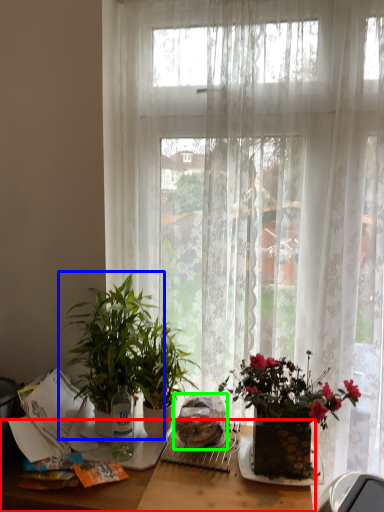
Question: Considering the real-world distances, which object is farthest from table (highlighted by a red box)? houseplant (highlighted by a blue box) or food (highlighted by a green box)?

Choices:
 (A) houseplant
 (B) food

Answer: (A)